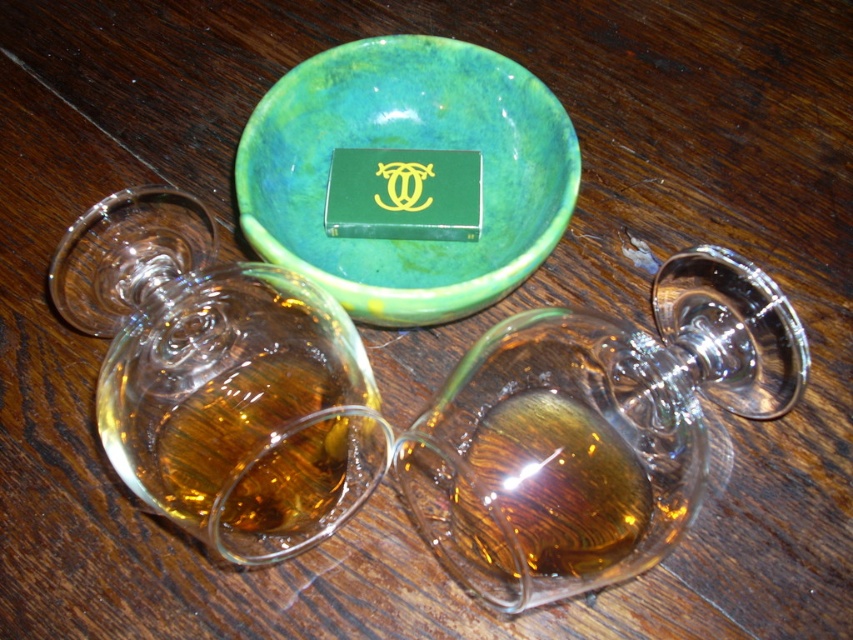
Which of these two, transparent glass wine glass at center or green marbled bowl at center, stands shorter?

green marbled bowl at center

Does transparent glass wine glass at center have a smaller size compared to green marbled bowl at center?

Correct, transparent glass wine glass at center occupies less space than green marbled bowl at center.

Is point (477, 497) closer to camera compared to point (537, 256)?

No.

Identify the location of transparent glass wine glass at center. tap(596, 429).